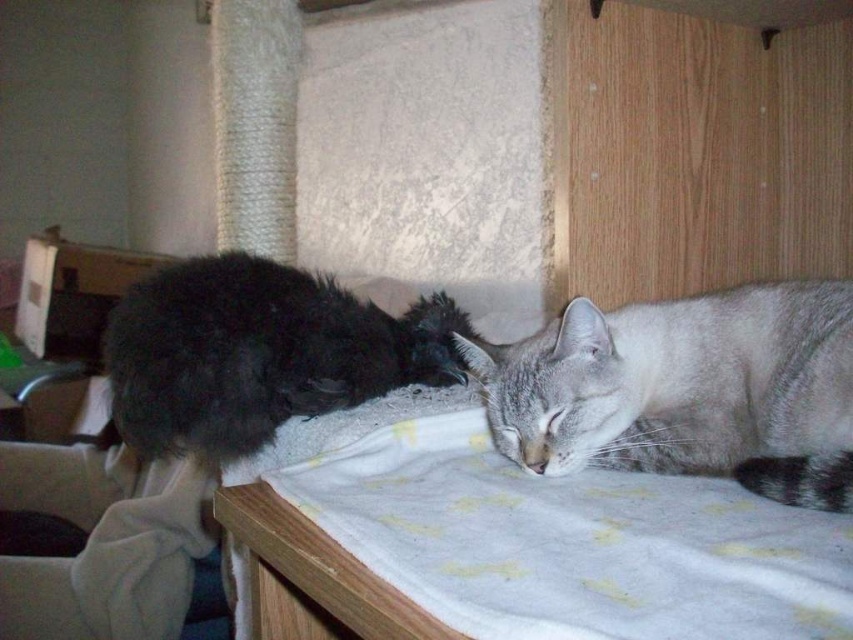
Can you confirm if white soft blanket at center is taller than fluffy black cat at left?

In fact, white soft blanket at center may be shorter than fluffy black cat at left.

This screenshot has height=640, width=853. What are the coordinates of `white soft blanket at center` in the screenshot? It's located at (554, 532).

Which is more to the left, gray fur cat at center or fluffy black cat at left?

fluffy black cat at left

Is point (747, 314) positioned behind point (233, 275)?

No, it is in front of (233, 275).

At what (x,y) coordinates should I click in order to perform the action: click on gray fur cat at center. Please return your answer as a coordinate pair (x, y). Image resolution: width=853 pixels, height=640 pixels. Looking at the image, I should click on (686, 388).

Describe the element at coordinates (554, 532) in the screenshot. I see `white soft blanket at center` at that location.

Between white soft blanket at center and gray fur cat at center, which one has more height?

gray fur cat at center is taller.

Describe the element at coordinates (554, 532) in the screenshot. Image resolution: width=853 pixels, height=640 pixels. I see `white soft blanket at center` at that location.

Where is `white soft blanket at center`? white soft blanket at center is located at coordinates (554, 532).